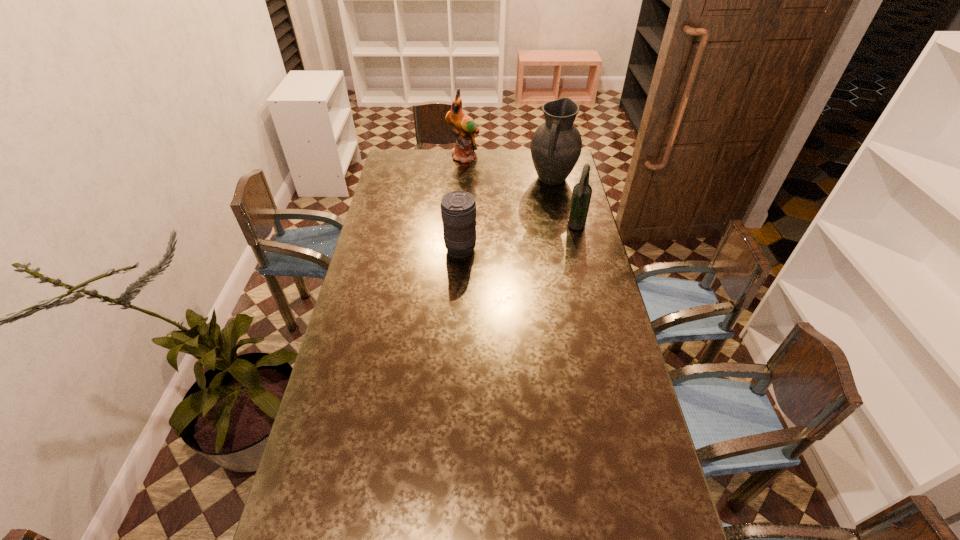
Find the location of a particular element. The width and height of the screenshot is (960, 540). vacant space located 0.050m on the side of the third nearest object with the handle is located at coordinates click(544, 199).

Locate an element on the screen. The width and height of the screenshot is (960, 540). vacant space located on the side of the third nearest object with the handle is located at coordinates (534, 224).

Find the location of a particular element. free space located 0.250m on the side of the third nearest object with the handle is located at coordinates (533, 225).

Where is `vacant region located 0.210m on the front-facing side of the parrot`? vacant region located 0.210m on the front-facing side of the parrot is located at coordinates (478, 187).

This screenshot has height=540, width=960. Identify the location of blank area located 0.220m on the front-facing side of the parrot. (478, 188).

Locate an element on the screen. vacant space situated 0.060m on the front-facing side of the parrot is located at coordinates (470, 171).

Find the location of a particular element. The image size is (960, 540). pitcher positioned at the far edge is located at coordinates (556, 145).

Find the location of a particular element. parrot situated at the far edge is located at coordinates (465, 127).

I want to click on beer bottle located at the right edge, so click(582, 191).

This screenshot has width=960, height=540. I want to click on pitcher that is at the right edge, so 556,145.